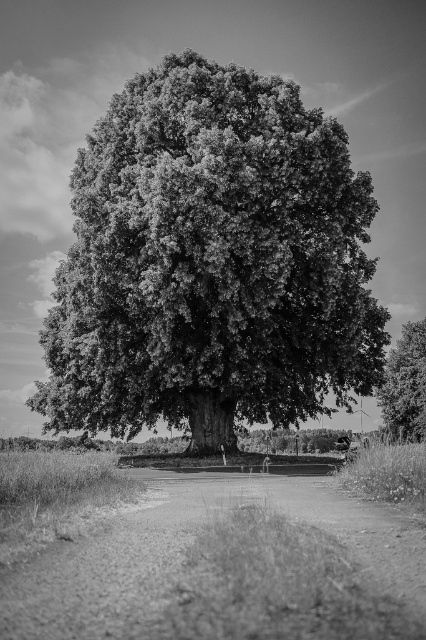
Does smooth bark oak tree at center lie behind dark green textured tree at right?

No.

This screenshot has height=640, width=426. In order to click on smooth bark oak tree at center in this screenshot , I will do `click(212, 262)`.